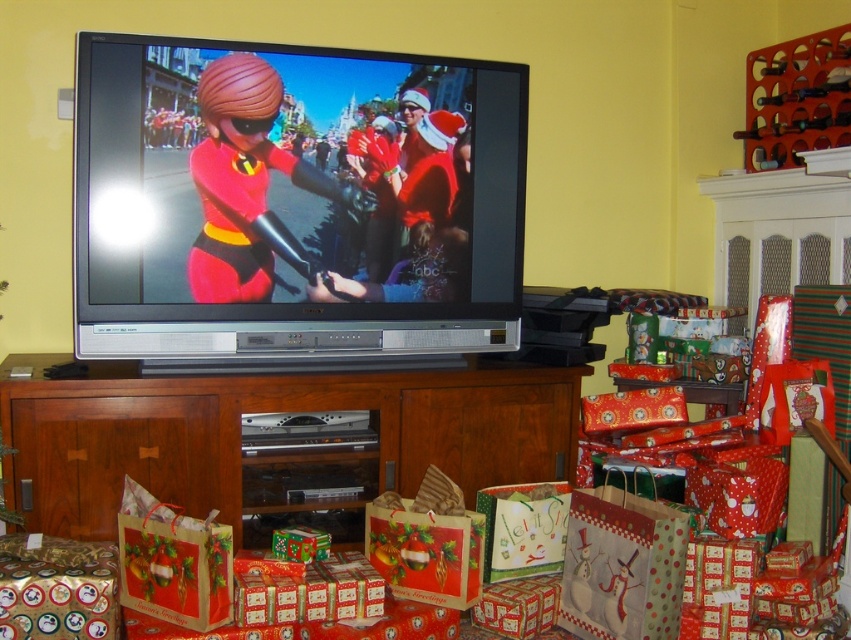
Who is lower down, matte black television at upper center or brown wood entertainment center at lower center?

brown wood entertainment center at lower center is below.

Which is above, matte black television at upper center or brown wood entertainment center at lower center?

matte black television at upper center

Where is `matte black television at upper center`? matte black television at upper center is located at coordinates (294, 200).